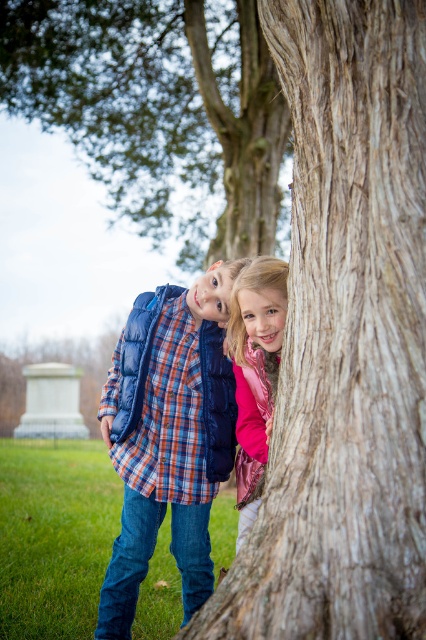
You are a photographer trying to capture both the blue down jacket at center and the pink metallic jacket at center in a single frame. Given their sizes, which jacket will appear bigger in the photo?

The blue down jacket at center will appear bigger in the photo because it has a larger size compared to the pink metallic jacket at center.

In the scene shown: You are a photographer trying to capture a shot of the rough bark tree at upper center and the pink metallic jacket at center. The camera you are using has a maximum focus range of 40 feet. Will you be able to focus on both subjects simultaneously?

The rough bark tree at upper center and pink metallic jacket at center are 43.40 feet apart from each other, so the camera cannot focus on both subjects at the same time because the distance exceeds the maximum focus range of 40 feet.

Looking at this image, you are a child trying to hide behind the tree. Which part of the tree should you hide behind to stay hidden from someone looking from above? The smooth brown bark at center or the rough bark tree at upper center?

You should hide behind the rough bark tree at upper center because the smooth brown bark at center is positioned under it, meaning the rough bark tree at upper center is higher up and would provide better coverage from above.